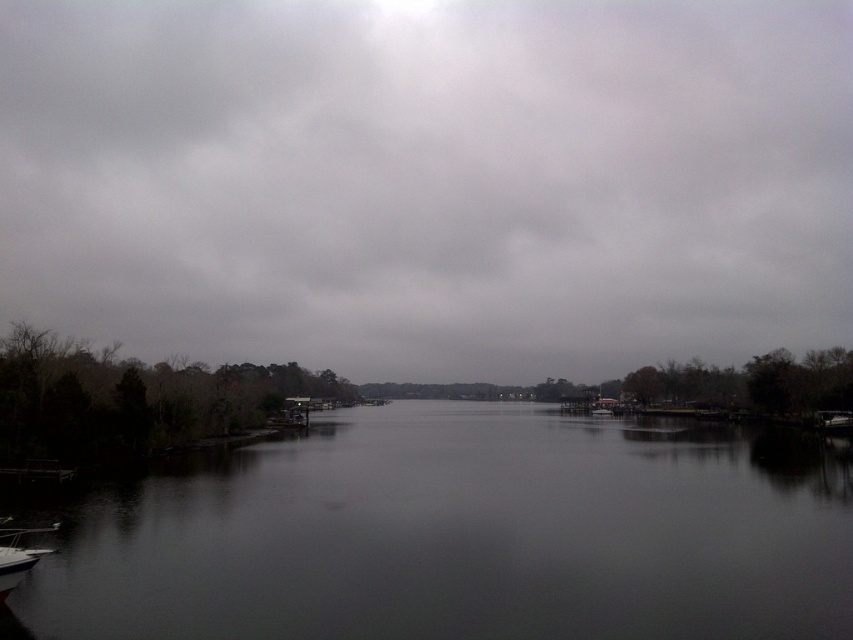
Consider the image. You are an observer standing on the bank of the waterway. You see the gray cloudy sky at upper center and the white glossy boat at lower left. Which object is higher in the scene?

The gray cloudy sky at upper center is much taller than the white glossy boat at lower left, so the gray cloudy sky at upper center is higher in the scene.

Looking at this image, you are navigating a small boat along the waterway in the image. You see two points marked on the map as point 1 at coordinates point [463,10] and point 2 at coordinates point [4,584]. Which point is closer to your boat if you are positioned at the center of the waterway?

Point [463,10] is closer to the boat because it is further to the viewer than point [4,584], meaning it is nearer in the scene.